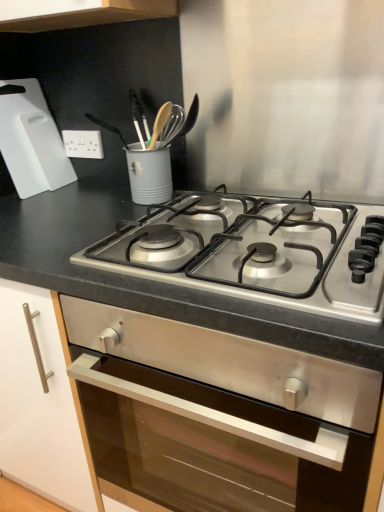
Question: In terms of height, does slate gray countertop at center look taller or shorter compared to white plastic electric outlet at upper left?

Choices:
 (A) tall
 (B) short

Answer: (A)

Question: Considering the positions of slate gray countertop at center and white plastic electric outlet at upper left in the image, is slate gray countertop at center bigger or smaller than white plastic electric outlet at upper left?

Choices:
 (A) big
 (B) small

Answer: (A)

Question: Which object is positioned closest to the stainless steel gas stove at center?

Choices:
 (A) white plastic cutting board at upper left
 (B) slate gray countertop at center
 (C) white plastic electric outlet at upper left

Answer: (B)

Question: Considering the real-world distances, which object is closest to the white plastic electric outlet at upper left?

Choices:
 (A) stainless steel gas stove at center
 (B) white plastic cutting board at upper left
 (C) slate gray countertop at center

Answer: (B)